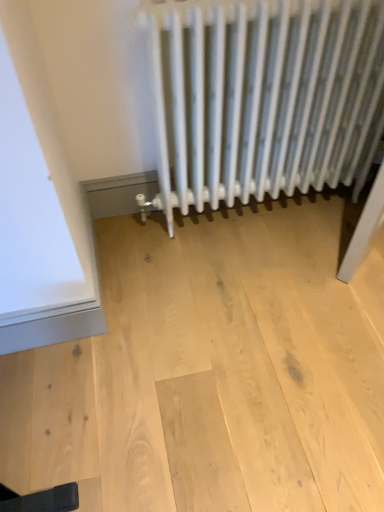
Locate an element on the screen. The width and height of the screenshot is (384, 512). vacant space underneath white matte radiator at center (from a real-world perspective) is located at coordinates (x=248, y=210).